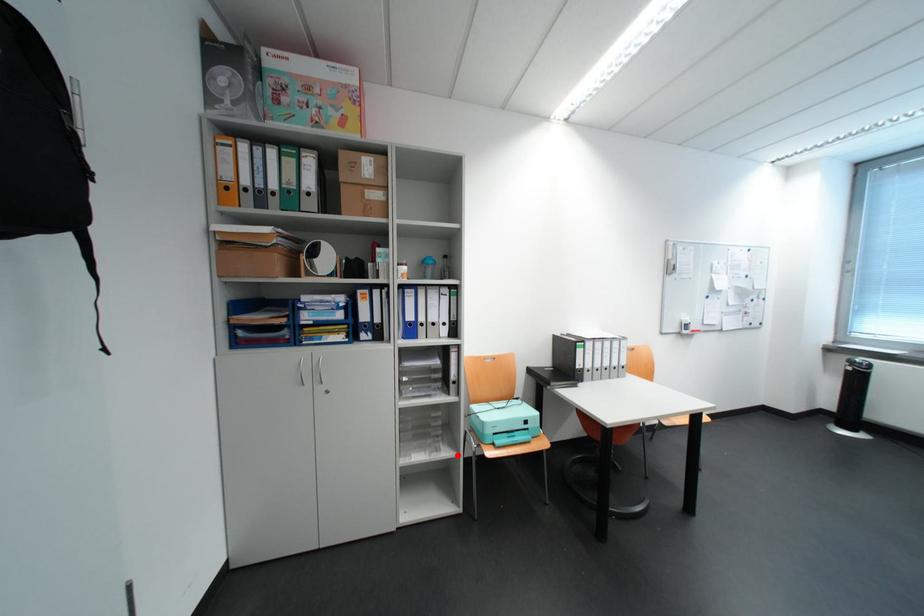
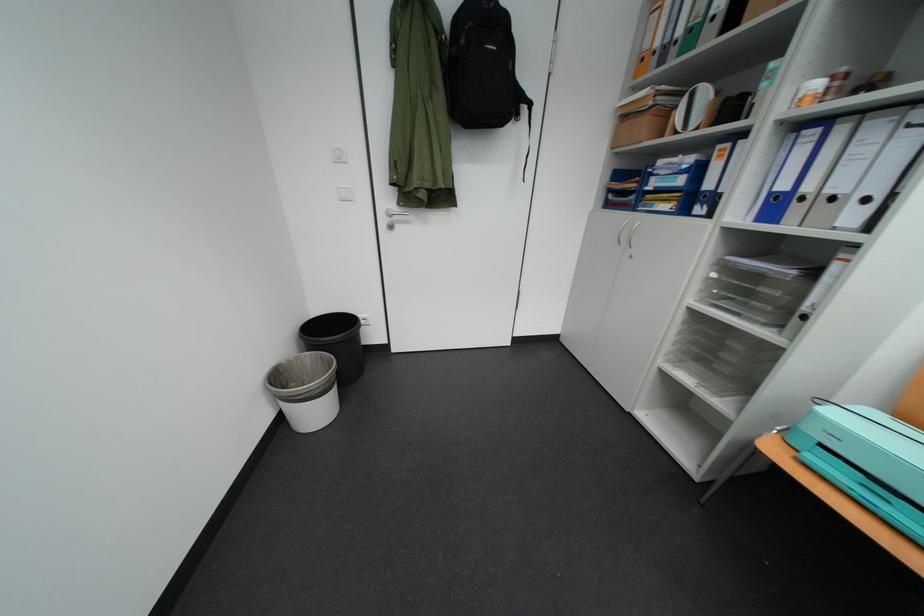
Question: I am providing you with two images of the same scene from different viewpoints. Given a red point in image1, look at the same physical point in image2. Is it:

Choices:
 (A) Closer to the viewpoint
 (B) Farther from the viewpoint

Answer: (A)